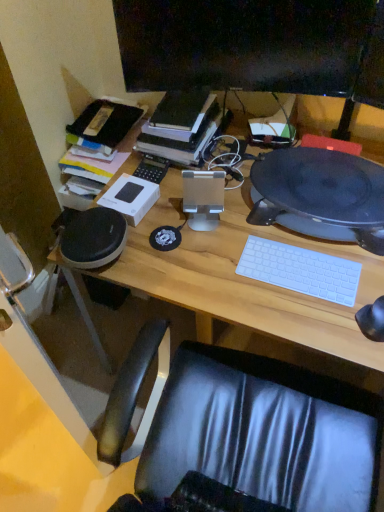
Find the location of `space that is in front of black matte speaker at right`. space that is in front of black matte speaker at right is located at coordinates (308, 294).